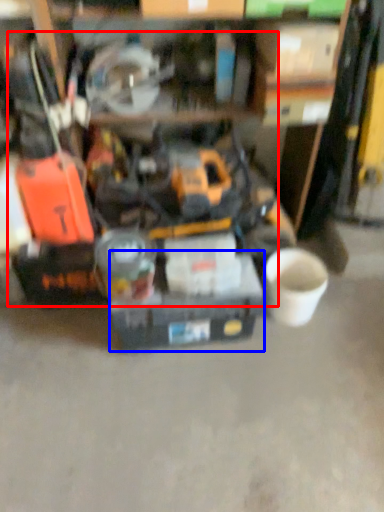
Question: Which of the following is the closest to the observer, tool (highlighted by a red box) or box (highlighted by a blue box)?

Choices:
 (A) tool
 (B) box

Answer: (A)